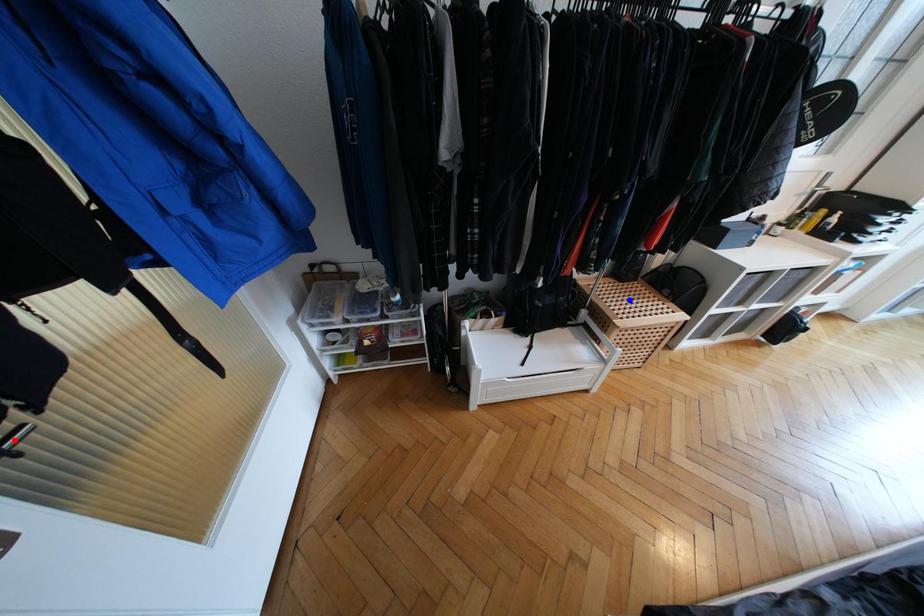
Question: In the image, two points are highlighted. Which point is nearer to the camera? Reply with the corresponding letter.

Choices:
 (A) blue point
 (B) red point

Answer: (B)